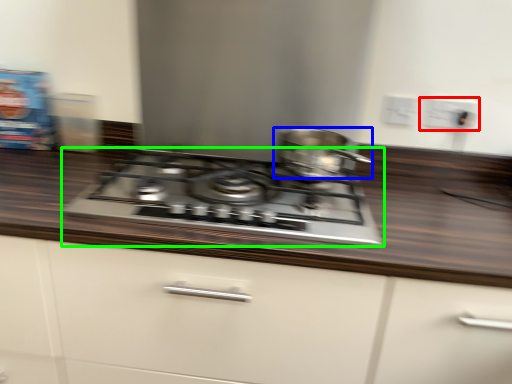
Question: Estimate the real-world distances between objects in this image. Which object is closer to electric outlet (highlighted by a red box), kitchen appliance (highlighted by a blue box) or gas stove (highlighted by a green box)?

Choices:
 (A) kitchen appliance
 (B) gas stove

Answer: (A)